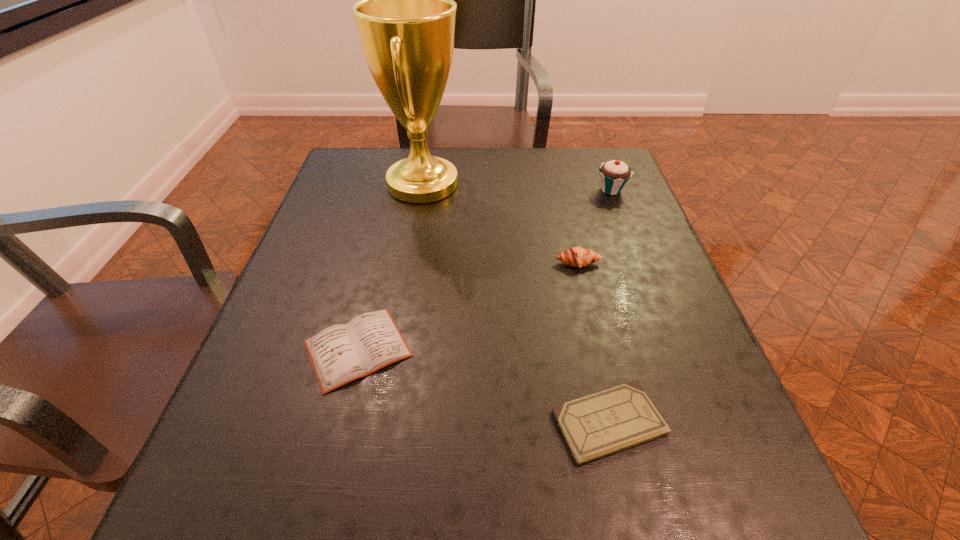
In order to click on the tallest object in this screenshot , I will do `click(406, 16)`.

Identify the location of the rightmost object. The width and height of the screenshot is (960, 540). (614, 174).

The height and width of the screenshot is (540, 960). What are the coordinates of `cupcake` in the screenshot? It's located at (614, 174).

Where is `pastry`? Image resolution: width=960 pixels, height=540 pixels. pastry is located at coordinates (578, 257).

This screenshot has height=540, width=960. Find the location of `the third farthest object`. the third farthest object is located at coordinates (578, 257).

Where is `diary`? This screenshot has height=540, width=960. diary is located at coordinates (341, 353).

Find the location of a particular element. This screenshot has height=540, width=960. checkbook is located at coordinates (618, 418).

Find the location of `vacant space positioned by the handles of the tallest object`. vacant space positioned by the handles of the tallest object is located at coordinates (496, 185).

Find the location of `vacant space located on the left of the rightmost object`. vacant space located on the left of the rightmost object is located at coordinates (475, 190).

Find the location of a particular element. vacant space located on the front-facing side of the third farthest object is located at coordinates (597, 343).